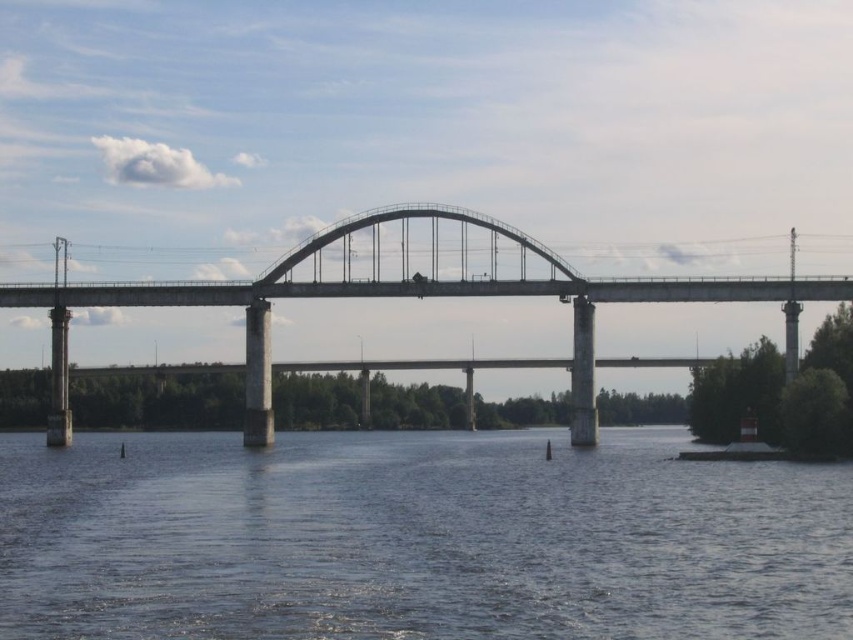
Is point (410, 628) closer to viewer compared to point (850, 285)?

That is True.

Does point (389, 512) come farther from viewer compared to point (399, 205)?

No, it is not.

Identify the location of dark blue water at center. The width and height of the screenshot is (853, 640). (416, 540).